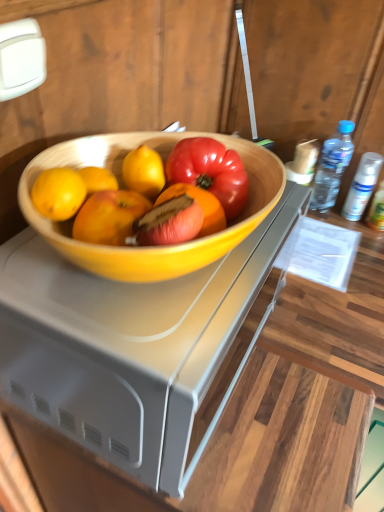
Question: Is wooden desk at center inside clear plastic spray can at upper right, which is the 1th bottle in right-to-left order?

Choices:
 (A) no
 (B) yes

Answer: (A)

Question: Is clear plastic spray can at upper right, which is the 1th bottle in right-to-left order, bigger than wooden desk at center?

Choices:
 (A) no
 (B) yes

Answer: (A)

Question: Does clear plastic spray can at upper right, the 3th bottle when ordered from left to right, turn towards wooden desk at center?

Choices:
 (A) no
 (B) yes

Answer: (A)

Question: Can you confirm if clear plastic spray can at upper right, the 3th bottle when ordered from left to right, is smaller than wooden desk at center?

Choices:
 (A) yes
 (B) no

Answer: (A)

Question: Is clear plastic spray can at upper right, the 3th bottle when ordered from left to right, to the right of wooden desk at center from the viewer's perspective?

Choices:
 (A) yes
 (B) no

Answer: (A)

Question: Based on their sizes in the image, would you say transparent plastic bottle at right, the 1th bottle when ordered from left to right, is bigger or smaller than wooden desk at center?

Choices:
 (A) big
 (B) small

Answer: (B)

Question: Do you think transparent plastic bottle at right, the 1th bottle when ordered from left to right, is within wooden desk at center, or outside of it?

Choices:
 (A) inside
 (B) outside

Answer: (B)

Question: From a real-world perspective, relative to wooden desk at center, is transparent plastic bottle at right, the 1th bottle when ordered from left to right, vertically above or below?

Choices:
 (A) below
 (B) above

Answer: (A)

Question: Based on their positions, is transparent plastic bottle at right, the 3th bottle viewed from the right, located to the left or right of wooden desk at center?

Choices:
 (A) left
 (B) right

Answer: (B)

Question: Considering the positions of point (66, 375) and point (332, 166), is point (66, 375) closer or farther from the camera than point (332, 166)?

Choices:
 (A) closer
 (B) farther

Answer: (A)

Question: From a real-world perspective, relative to transparent plastic bottle at right, the 3th bottle viewed from the right, is wooden desk at center vertically above or below?

Choices:
 (A) above
 (B) below

Answer: (A)

Question: Considering the relative positions of wooden desk at center and transparent plastic bottle at right, the 3th bottle viewed from the right, in the image provided, is wooden desk at center to the left or to the right of transparent plastic bottle at right, the 3th bottle viewed from the right,?

Choices:
 (A) left
 (B) right

Answer: (A)

Question: In terms of width, does wooden desk at center look wider or thinner when compared to transparent plastic bottle at right, the 1th bottle when ordered from left to right?

Choices:
 (A) thin
 (B) wide

Answer: (B)

Question: In the image, is white matte spray can at right, which is the 2th bottle in left-to-right order, on the left side or the right side of wooden desk at center?

Choices:
 (A) left
 (B) right

Answer: (B)

Question: From a real-world perspective, is white matte spray can at right, which is the 2th bottle in left-to-right order, above or below wooden desk at center?

Choices:
 (A) below
 (B) above

Answer: (A)